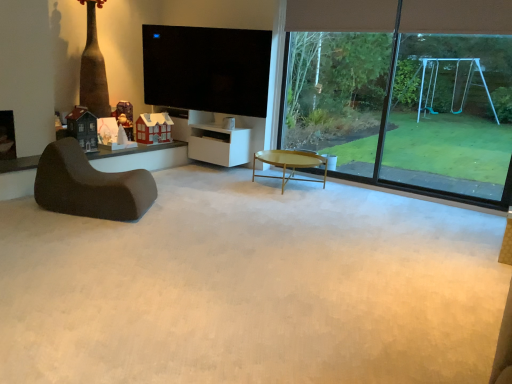
Find the location of a particular element. Image resolution: width=512 pixels, height=384 pixels. free space on the front side of gold metallic coffee table at center is located at coordinates (288, 201).